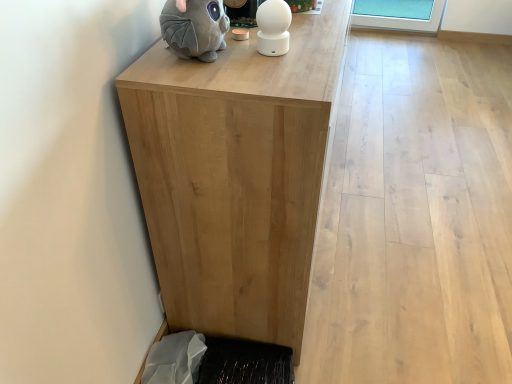
Question: Can you confirm if black textured mat at lower left is bigger than natural wood table at center?

Choices:
 (A) no
 (B) yes

Answer: (A)

Question: Would you consider black textured mat at lower left to be distant from natural wood table at center?

Choices:
 (A) no
 (B) yes

Answer: (A)

Question: From the image's perspective, does black textured mat at lower left appear lower than natural wood table at center?

Choices:
 (A) yes
 (B) no

Answer: (A)

Question: Is natural wood table at center inside black textured mat at lower left?

Choices:
 (A) no
 (B) yes

Answer: (A)

Question: Is black textured mat at lower left positioned in front of natural wood table at center?

Choices:
 (A) yes
 (B) no

Answer: (B)

Question: From the image's perspective, is gray plush toy at upper left positioned above or below black textured mat at lower left?

Choices:
 (A) above
 (B) below

Answer: (A)

Question: Considering the relative positions of gray plush toy at upper left and black textured mat at lower left in the image provided, is gray plush toy at upper left to the left or to the right of black textured mat at lower left?

Choices:
 (A) right
 (B) left

Answer: (B)

Question: Considering the positions of gray plush toy at upper left and black textured mat at lower left in the image, is gray plush toy at upper left taller or shorter than black textured mat at lower left?

Choices:
 (A) tall
 (B) short

Answer: (A)

Question: In terms of size, does gray plush toy at upper left appear bigger or smaller than black textured mat at lower left?

Choices:
 (A) small
 (B) big

Answer: (A)

Question: In the image, is natural wood table at center positioned in front of or behind black textured mat at lower left?

Choices:
 (A) behind
 (B) front

Answer: (B)

Question: Is point (285, 114) closer or farther from the camera than point (290, 372)?

Choices:
 (A) closer
 (B) farther

Answer: (A)

Question: Is natural wood table at center spatially inside black textured mat at lower left, or outside of it?

Choices:
 (A) inside
 (B) outside

Answer: (B)

Question: From their relative heights in the image, would you say natural wood table at center is taller or shorter than black textured mat at lower left?

Choices:
 (A) short
 (B) tall

Answer: (B)

Question: Is gray plush toy at upper left inside the boundaries of white glossy ball at upper center, or outside?

Choices:
 (A) outside
 (B) inside

Answer: (A)

Question: Based on their sizes in the image, would you say gray plush toy at upper left is bigger or smaller than white glossy ball at upper center?

Choices:
 (A) big
 (B) small

Answer: (A)